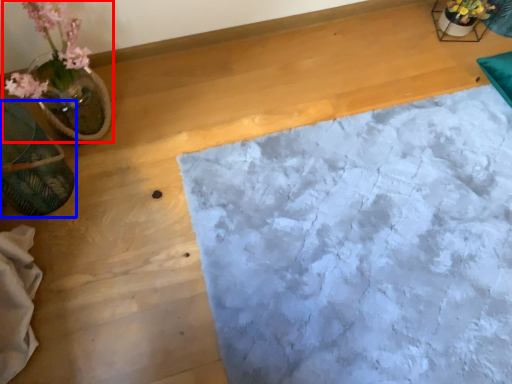
Question: Which point is closer to the camera, houseplant (highlighted by a red box) or flowerpot (highlighted by a blue box)?

Choices:
 (A) houseplant
 (B) flowerpot

Answer: (A)